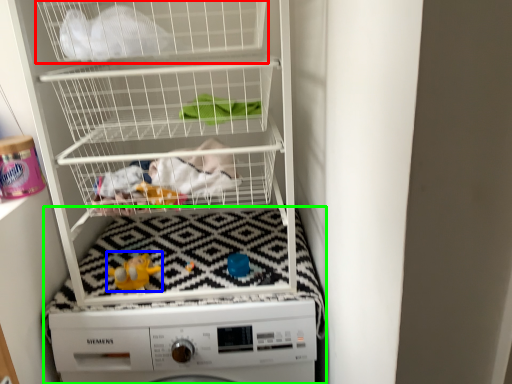
Question: Which is farther away from shelf (highlighted by a red box)? toy (highlighted by a blue box) or machine (highlighted by a green box)?

Choices:
 (A) toy
 (B) machine

Answer: (B)